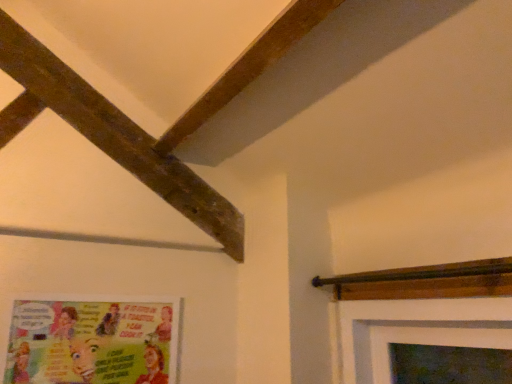
Identify the location of multicolored paper poster at lower left. (93, 340).

The width and height of the screenshot is (512, 384). Describe the element at coordinates (93, 340) in the screenshot. I see `multicolored paper poster at lower left` at that location.

The height and width of the screenshot is (384, 512). Identify the location of multicolored paper poster at lower left. (93, 340).